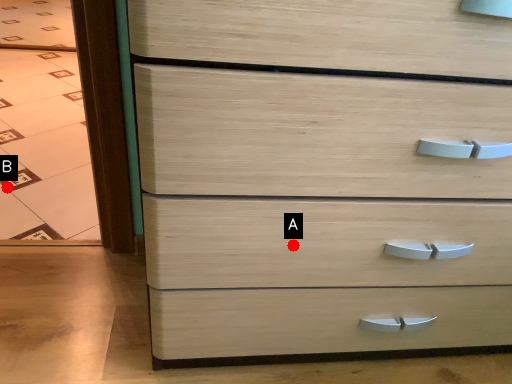
Question: Two points are circled on the image, labeled by A and B beside each circle. Which point is closer to the camera taking this photo?

Choices:
 (A) A is closer
 (B) B is closer

Answer: (A)